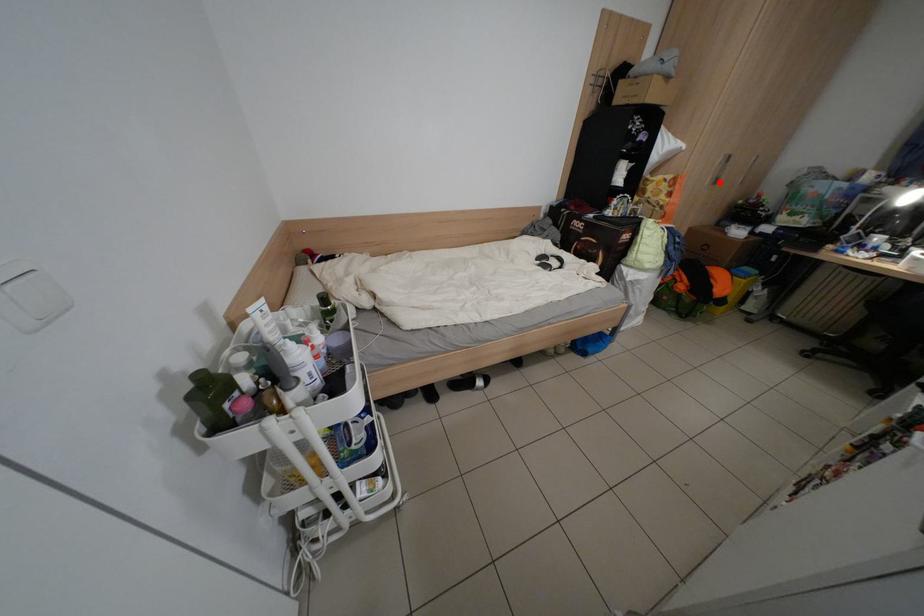
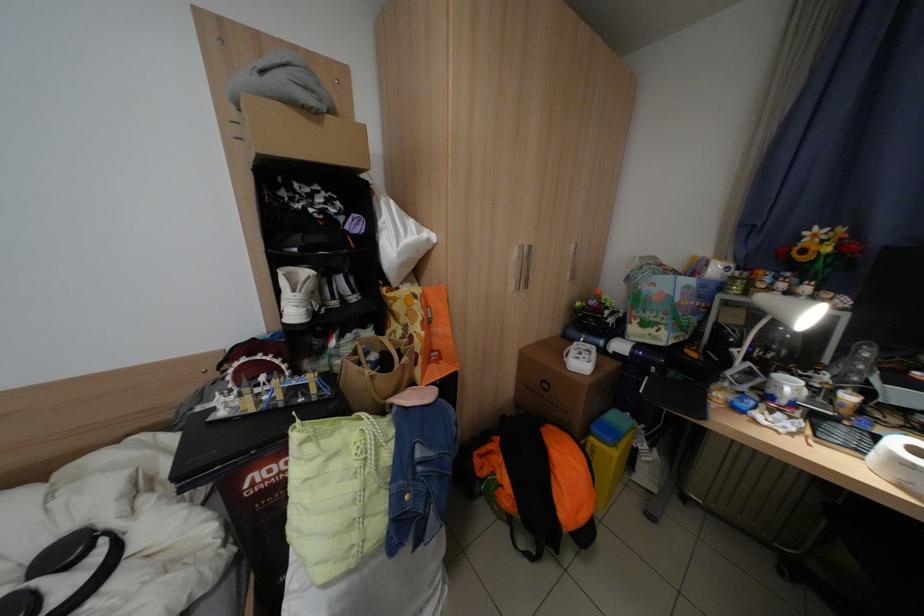
The point at the highlighted location is marked in the first image. Where is the corresponding point in the second image?

(524, 286)